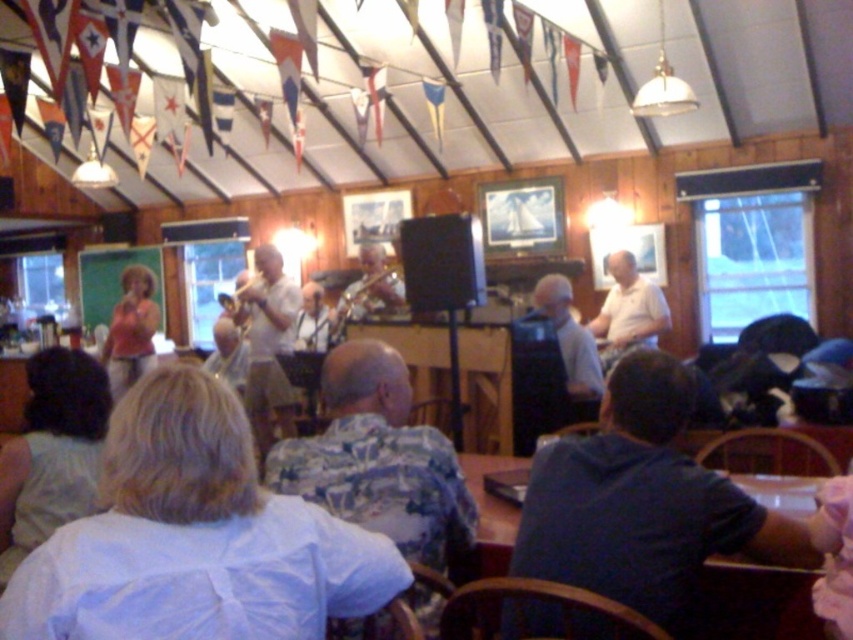
You are a photographer at the event and want to capture both the light blue shirt at center and the silver metallic saxophone at center in a single frame. Which object should you focus on first to ensure both are in the frame?

You should focus on the silver metallic saxophone at center first because it is larger than the light blue shirt at center, allowing you to frame it first and then adjust to include the smaller object.

You are a photographer positioned at the back of the room and want to take a photo of both the light blue cotton shirt at center and the dark blue shirt at lower right. Which shirt will appear shorter in the photo?

The light blue cotton shirt at center will appear shorter in the photo because it is physically shorter than the dark blue shirt at lower right.